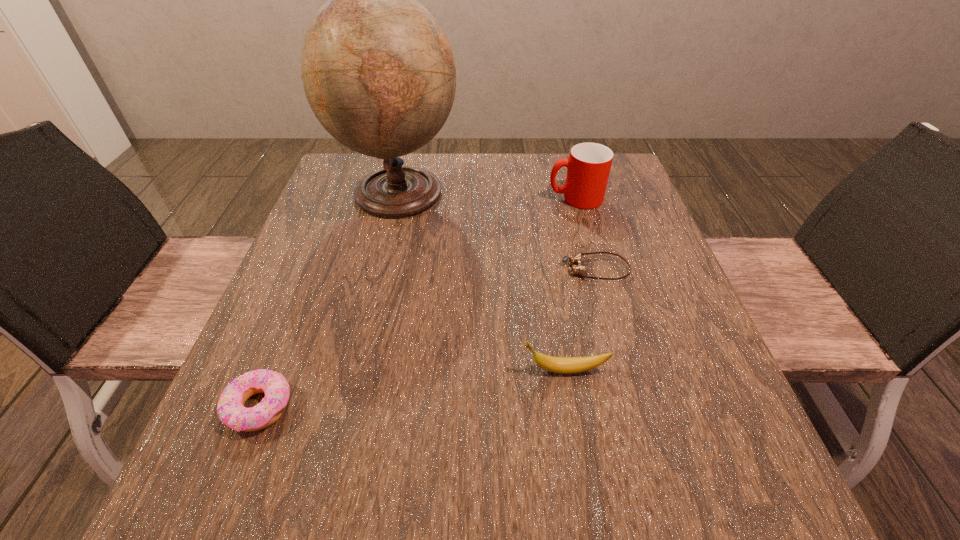
Where is `free space between the banana and the shortest object`? The width and height of the screenshot is (960, 540). free space between the banana and the shortest object is located at coordinates (580, 320).

Identify which object is the nearest to the fourth tallest object. Please provide its 2D coordinates. Your answer should be formatted as a tuple, i.e. [(x, y)], where the tuple contains the x and y coordinates of a point satisfying the conditions above.

[(567, 365)]

Where is `object that stands as the second closest to the shortest object`? The image size is (960, 540). object that stands as the second closest to the shortest object is located at coordinates (567, 365).

This screenshot has width=960, height=540. Identify the location of free space that satisfies the following two spatial constraints: 1. on the front-facing side of the globe; 2. on the side of the second tallest object with the handle. (397, 198).

The image size is (960, 540). Find the location of `vacant region that satisfies the following two spatial constraints: 1. on the back side of the doughnut; 2. on the side of the fourth shortest object with the handle`. vacant region that satisfies the following two spatial constraints: 1. on the back side of the doughnut; 2. on the side of the fourth shortest object with the handle is located at coordinates (343, 198).